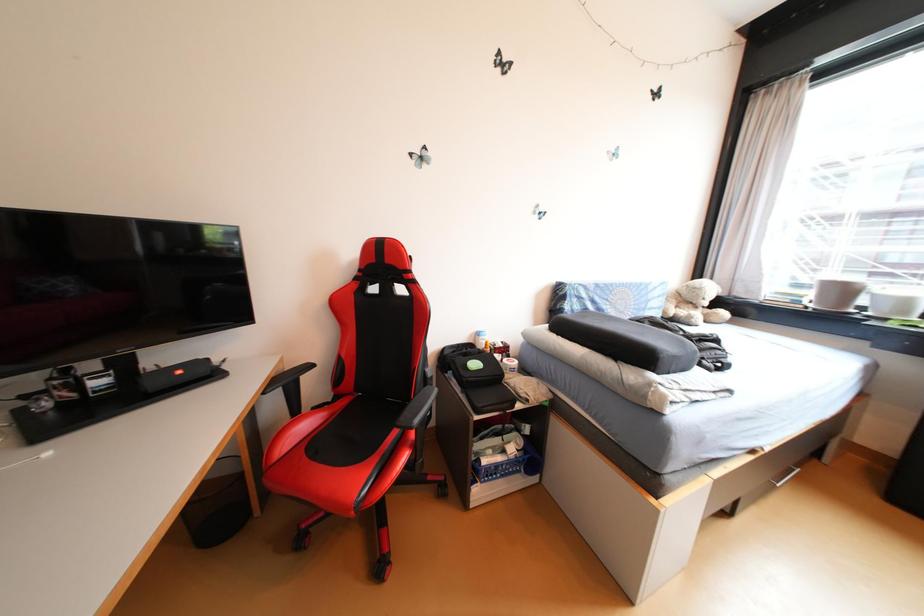
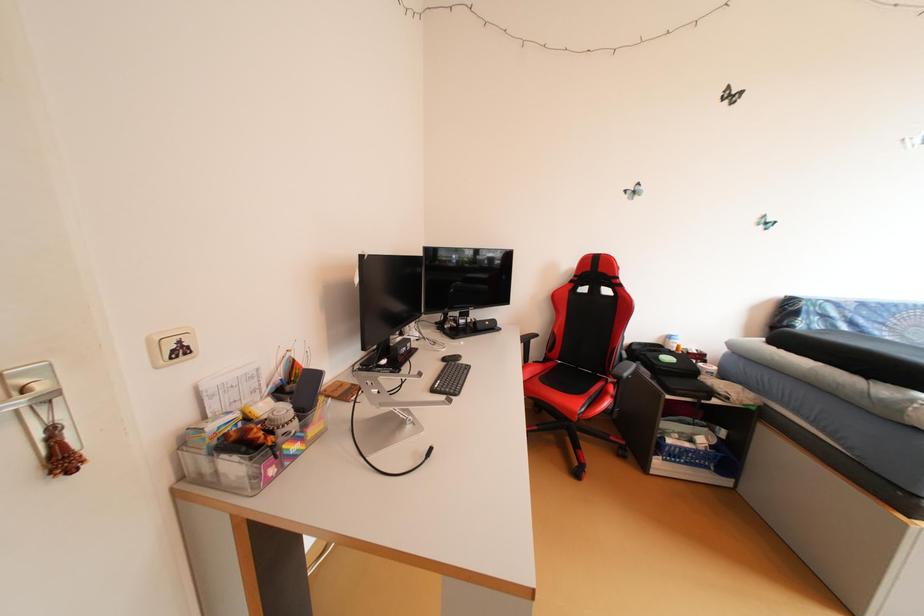
Question: The images are taken continuously from a first-person perspective. In which direction is your viewpoint rotating?

Choices:
 (A) Left
 (B) Right
 (C) Up
 (D) Down

Answer: (A)